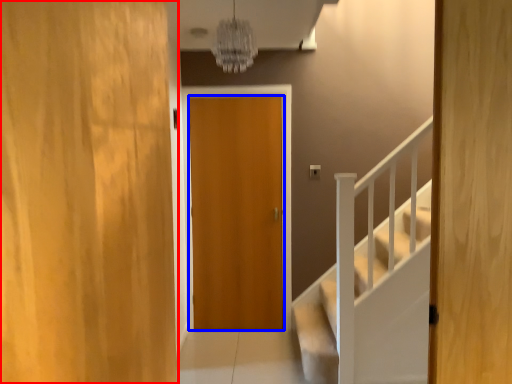
Question: Which point is closer to the camera, door (highlighted by a red box) or door (highlighted by a blue box)?

Choices:
 (A) door
 (B) door

Answer: (A)